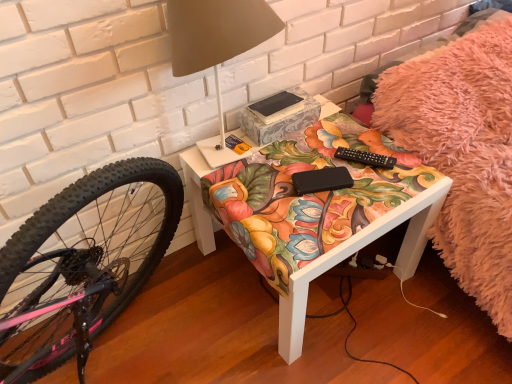
Question: Considering the positions of point (200, 56) and point (298, 109), is point (200, 56) closer or farther from the camera than point (298, 109)?

Choices:
 (A) farther
 (B) closer

Answer: (B)

Question: From the image's perspective, is matte white table lamp at upper center positioned above or below black matte book at center?

Choices:
 (A) below
 (B) above

Answer: (B)

Question: Estimate the real-world distances between objects in this image. Which object is closer to the matte white table lamp at upper center?

Choices:
 (A) black matte book at center
 (B) matte floral-patterned table at center

Answer: (A)

Question: Which object is positioned farthest from the matte white table lamp at upper center?

Choices:
 (A) black matte book at center
 (B) matte floral-patterned table at center

Answer: (B)